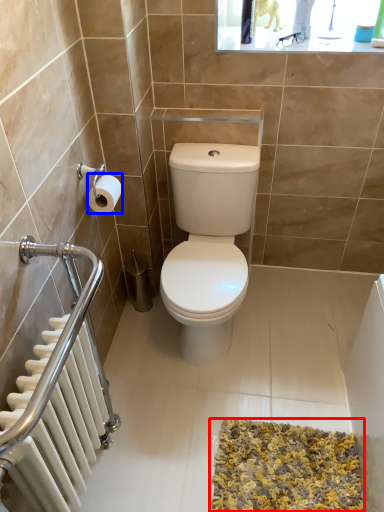
Question: Among these objects, which one is farthest to the camera, bath mat (highlighted by a red box) or toilet paper (highlighted by a blue box)?

Choices:
 (A) bath mat
 (B) toilet paper

Answer: (B)